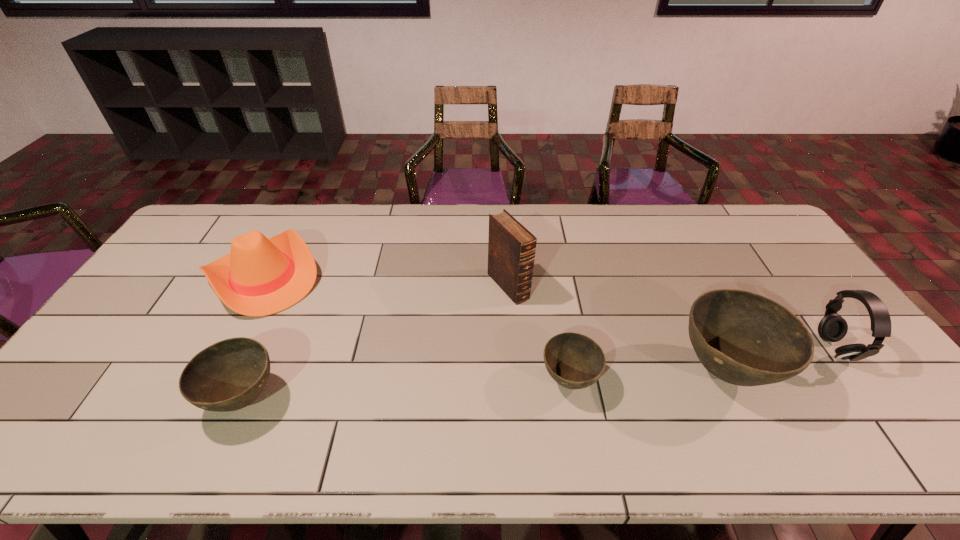
Locate an element on the screen. Image resolution: width=960 pixels, height=540 pixels. vacant space that is in between the earphone and the shortest object is located at coordinates (701, 364).

Identify the location of free space between the rightmost bowl and the second shortest object. (484, 385).

Where is `empty space that is in between the tallest object and the cowboy hat`? The image size is (960, 540). empty space that is in between the tallest object and the cowboy hat is located at coordinates (386, 281).

Where is `the second closest object to the shortest bowl`? The image size is (960, 540). the second closest object to the shortest bowl is located at coordinates (743, 338).

Where is `object that is the fifth closest one to the cowboy hat`? The height and width of the screenshot is (540, 960). object that is the fifth closest one to the cowboy hat is located at coordinates (832, 327).

Select which bowl appears as the second closest to the rightmost bowl. Please provide its 2D coordinates. Your answer should be formatted as a tuple, i.e. [(x, y)], where the tuple contains the x and y coordinates of a point satisfying the conditions above.

[(228, 375)]

Choose which bowl is the second nearest neighbor to the cowboy hat. Please provide its 2D coordinates. Your answer should be formatted as a tuple, i.e. [(x, y)], where the tuple contains the x and y coordinates of a point satisfying the conditions above.

[(575, 361)]

Image resolution: width=960 pixels, height=540 pixels. In order to click on vacant position in the image that satisfies the following two spatial constraints: 1. on the front side of the cowboy hat; 2. on the right side of the shortest object in this screenshot , I will do `click(209, 380)`.